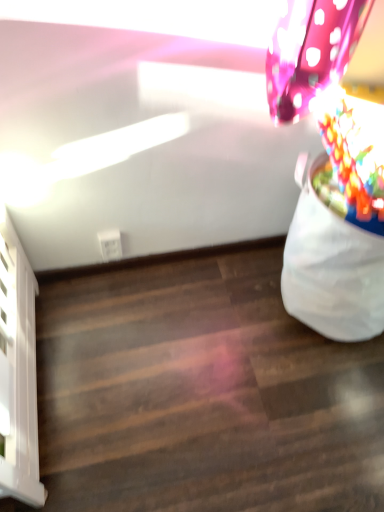
Question: From the image's perspective, is wooden floor at lower right located above white fabric bean bag at right?

Choices:
 (A) yes
 (B) no

Answer: (B)

Question: Is wooden floor at lower right taller than white fabric bean bag at right?

Choices:
 (A) yes
 (B) no

Answer: (B)

Question: Is wooden floor at lower right positioned behind white fabric bean bag at right?

Choices:
 (A) no
 (B) yes

Answer: (B)

Question: Considering the relative sizes of wooden floor at lower right and white fabric bean bag at right in the image provided, is wooden floor at lower right thinner than white fabric bean bag at right?

Choices:
 (A) yes
 (B) no

Answer: (B)

Question: Could you tell me if wooden floor at lower right is turned towards white fabric bean bag at right?

Choices:
 (A) yes
 (B) no

Answer: (B)

Question: Does point pyautogui.click(x=375, y=183) appear closer or farther from the camera than point pyautogui.click(x=125, y=482)?

Choices:
 (A) farther
 (B) closer

Answer: (B)

Question: In terms of width, does multicolored plastic flower at upper right look wider or thinner when compared to wooden floor at lower right?

Choices:
 (A) wide
 (B) thin

Answer: (B)

Question: Considering their positions, is multicolored plastic flower at upper right located in front of or behind wooden floor at lower right?

Choices:
 (A) front
 (B) behind

Answer: (A)

Question: From a real-world perspective, is multicolored plastic flower at upper right above or below wooden floor at lower right?

Choices:
 (A) below
 (B) above

Answer: (B)

Question: In terms of height, does wooden floor at lower right look taller or shorter compared to white fabric bean bag at right?

Choices:
 (A) short
 (B) tall

Answer: (A)

Question: Based on their positions, is wooden floor at lower right located to the left or right of white fabric bean bag at right?

Choices:
 (A) left
 (B) right

Answer: (A)

Question: Considering their positions, is wooden floor at lower right located in front of or behind white fabric bean bag at right?

Choices:
 (A) front
 (B) behind

Answer: (B)

Question: Looking at their shapes, would you say wooden floor at lower right is wider or thinner than white fabric bean bag at right?

Choices:
 (A) thin
 (B) wide

Answer: (B)

Question: Is wooden floor at lower right taller or shorter than multicolored plastic flower at upper right?

Choices:
 (A) short
 (B) tall

Answer: (A)

Question: From the image's perspective, is wooden floor at lower right above or below multicolored plastic flower at upper right?

Choices:
 (A) above
 (B) below

Answer: (B)